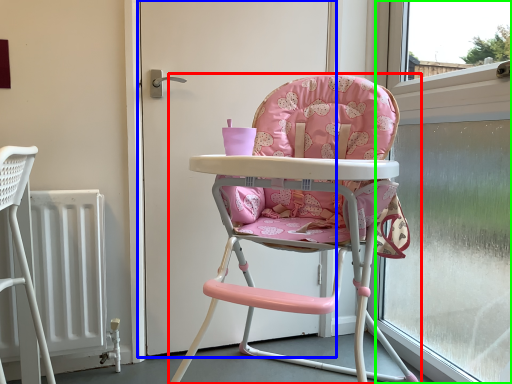
Question: Estimate the real-world distances between objects in this image. Which object is farther from chair (highlighted by a red box), screen door (highlighted by a blue box) or window screen (highlighted by a green box)?

Choices:
 (A) screen door
 (B) window screen

Answer: (B)